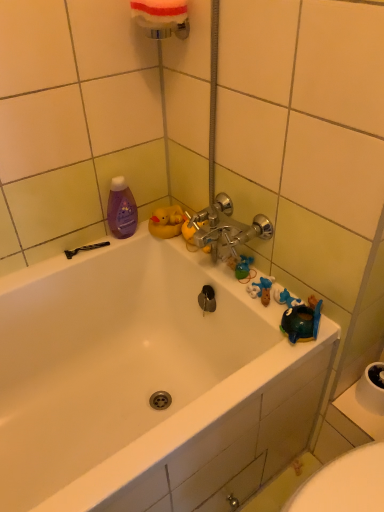
Where is `free region on the left part of purple glossy bottle at upper left`? The height and width of the screenshot is (512, 384). free region on the left part of purple glossy bottle at upper left is located at coordinates (79, 252).